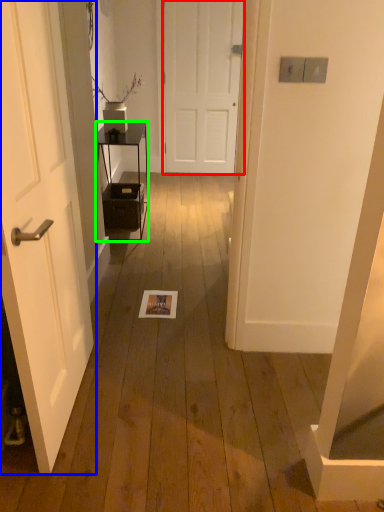
Question: Which object is positioned farthest from door (highlighted by a red box)? Select from door (highlighted by a blue box) and furniture (highlighted by a green box).

Choices:
 (A) door
 (B) furniture

Answer: (A)